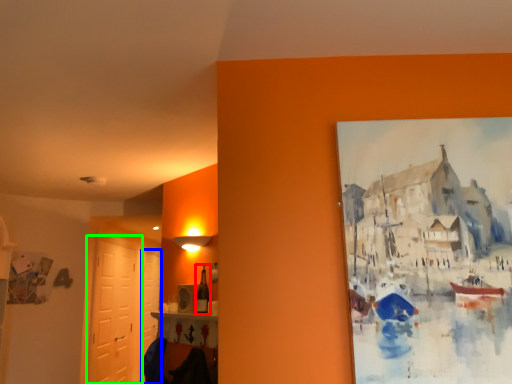
Question: Based on their relative distances, which object is nearer to bottle (highlighted by a red box)? Choose from door (highlighted by a blue box) and door (highlighted by a green box).

Choices:
 (A) door
 (B) door

Answer: (A)